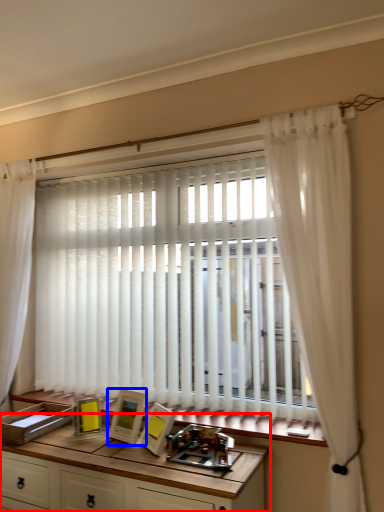
Question: Which point is further to the camera, table (highlighted by a red box) or picture frame (highlighted by a blue box)?

Choices:
 (A) table
 (B) picture frame

Answer: (B)